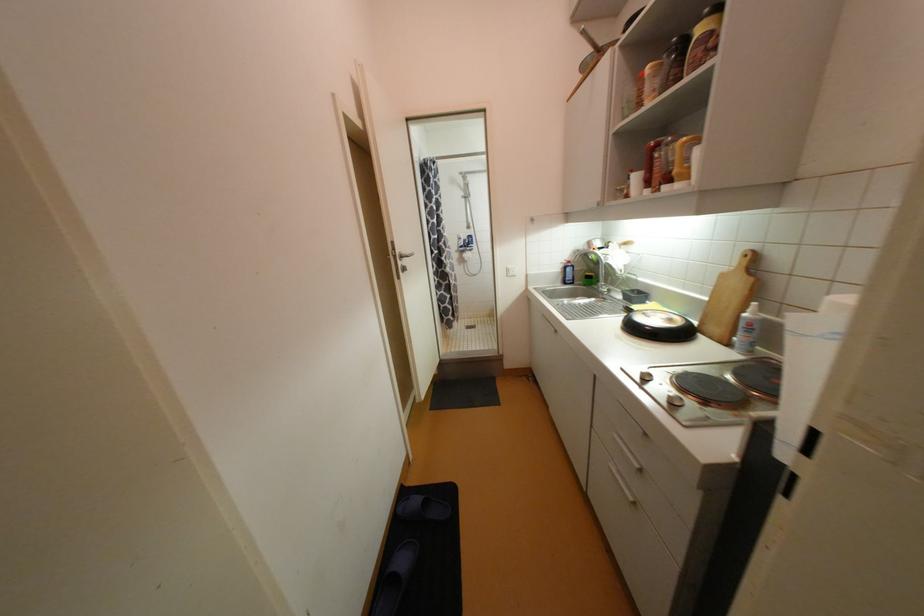
Where would you push the silver door handle? Please return your answer as a coordinate pair (x, y).

(405, 254)